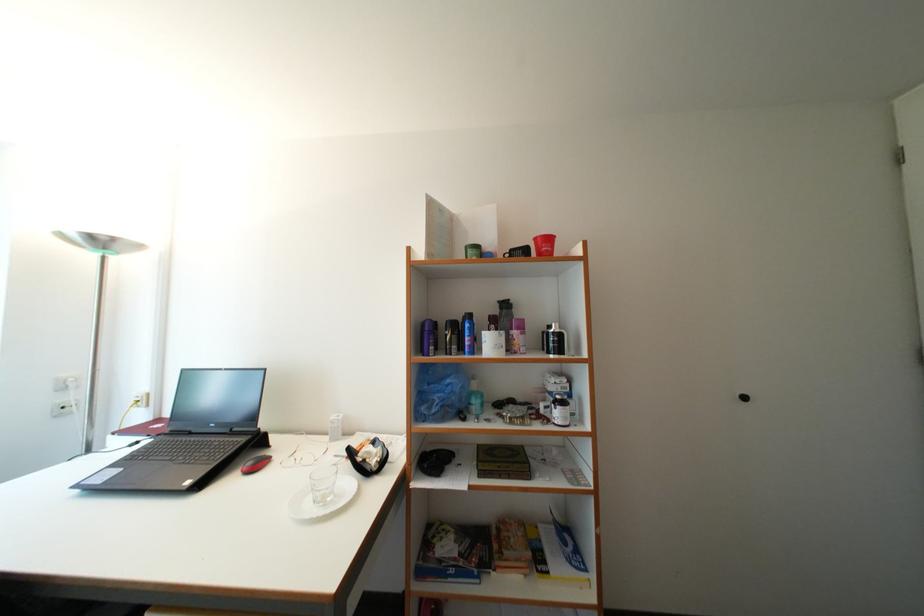
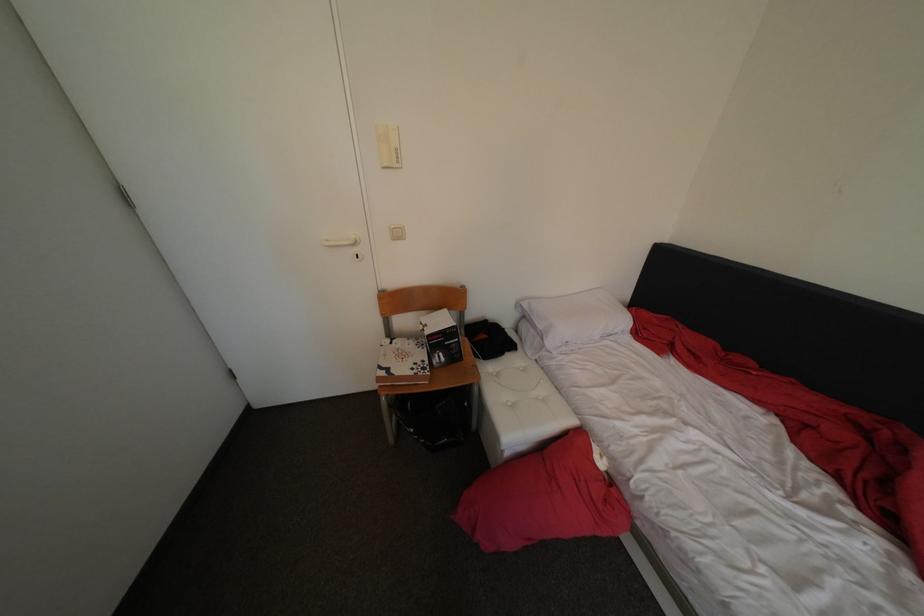
Based on the continuous images, in which direction is the camera rotating?

The camera's rotation is toward right-down.